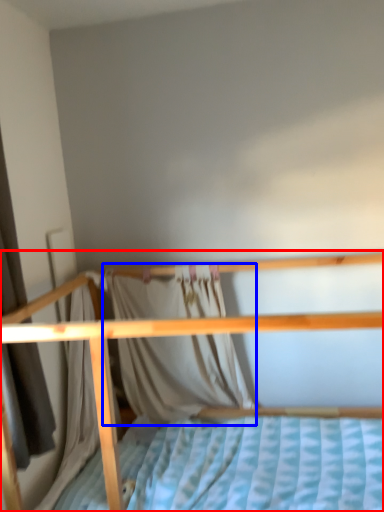
Question: Among these objects, which one is nearest to the camera, bed (highlighted by a red box) or curtain (highlighted by a blue box)?

Choices:
 (A) bed
 (B) curtain

Answer: (A)